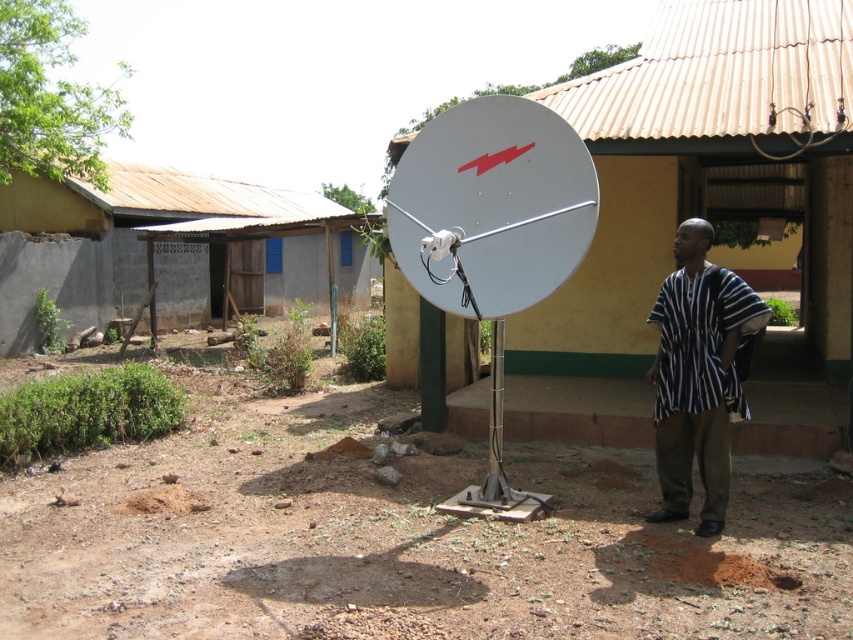
You are a technician trying to determine the relative sizes of the metallic satellite dish at center and the striped fabric shirt at right. Based on the scene, which object is wider?

The metallic satellite dish at center is wider than the striped fabric shirt at right because the description states that its width surpasses the shirt.

You are a technician trying to access the striped fabric shirt at right. To reach it, you need to walk around the white metallic satellite at center. Is there enough space to walk around the satellite dish?

The white metallic satellite at center might be wider than striped fabric shirt at right, so there may not be enough space to walk around it. You should check the width difference before attempting to move.

Consider the image. What are the coordinates of the brown soil at center in the image?

The coordinates of the brown soil at center are at point (399, 538).